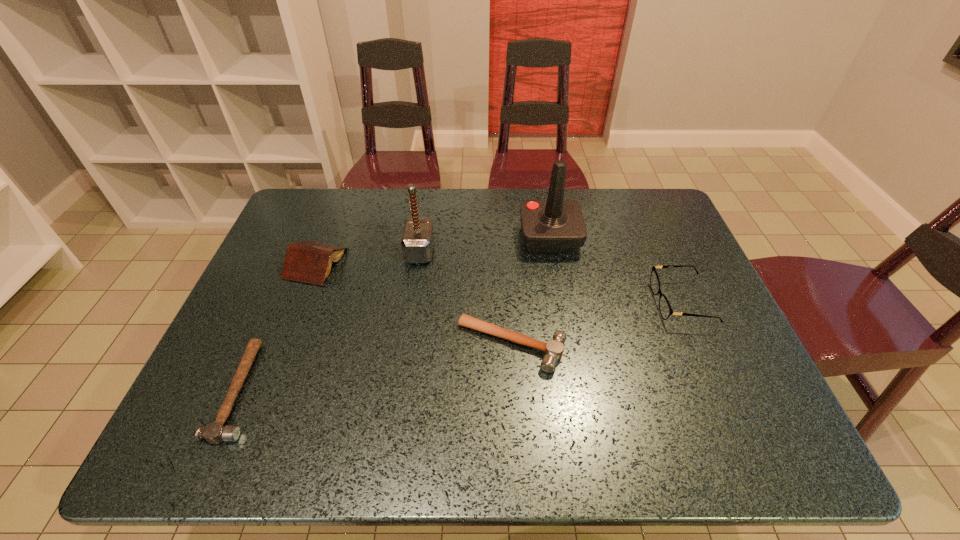
Identify which hammer is located as the third nearest to the book. Please provide its 2D coordinates. Your answer should be formatted as a tuple, i.e. [(x, y)], where the tuple contains the x and y coordinates of a point satisfying the conditions above.

[(553, 349)]